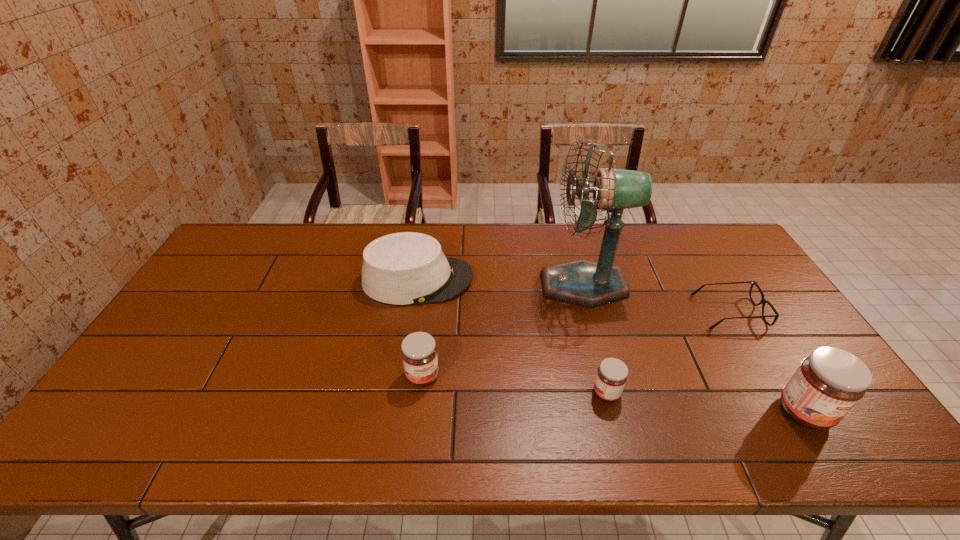
Locate an element on the screen. Image resolution: width=960 pixels, height=540 pixels. the closest jam relative to the second tallest object is located at coordinates (612, 374).

The height and width of the screenshot is (540, 960). In order to click on vacant area in the image that satisfies the following two spatial constraints: 1. with the lenses facing outward on the spectacles; 2. on the left side of the rightmost jam in this screenshot , I will do `click(789, 412)`.

Locate an element on the screen. The height and width of the screenshot is (540, 960). free location that satisfies the following two spatial constraints: 1. in front of the tallest object where the wind blows; 2. on the back side of the fifth shortest object is located at coordinates (616, 412).

The width and height of the screenshot is (960, 540). I want to click on free space in the image that satisfies the following two spatial constraints: 1. with the lenses facing outward on the spectacles; 2. on the front side of the shortest jam, so click(778, 393).

At what (x,y) coordinates should I click in order to perform the action: click on free space that satisfies the following two spatial constraints: 1. on the front side of the leftmost jam; 2. on the right side of the fifth tallest object. Please return your answer as a coordinate pair (x, y). Image resolution: width=960 pixels, height=540 pixels. Looking at the image, I should click on (420, 393).